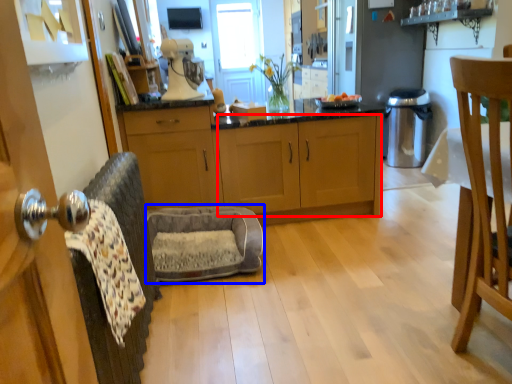
Question: Which object appears closest to the camera in this image, cabinetry (highlighted by a red box) or swivel chair (highlighted by a blue box)?

Choices:
 (A) cabinetry
 (B) swivel chair

Answer: (B)